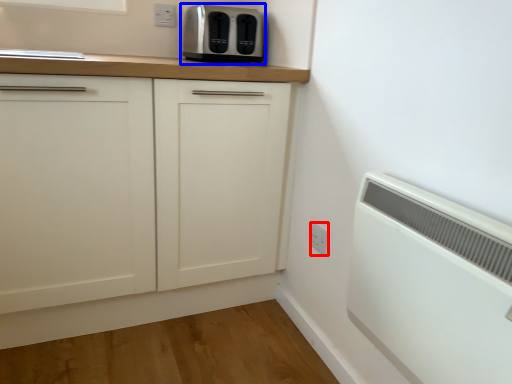
Question: Which point is further to the camera, electric outlet (highlighted by a red box) or toaster (highlighted by a blue box)?

Choices:
 (A) electric outlet
 (B) toaster

Answer: (B)